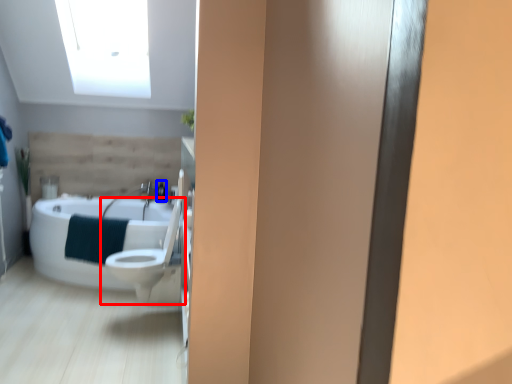
Question: Which of the following is the farthest to the observer, toilet (highlighted by a red box) or toiletry (highlighted by a blue box)?

Choices:
 (A) toilet
 (B) toiletry

Answer: (B)